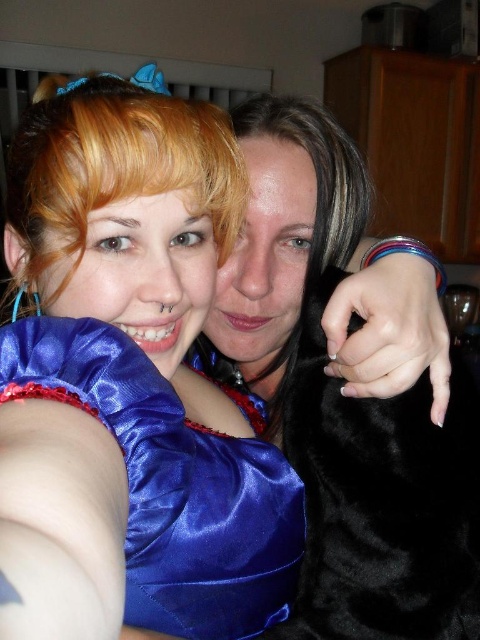
Between satin blue dress at upper left and blonde silky hair at upper left, which one appears on the right side from the viewer's perspective?

Positioned to the right is satin blue dress at upper left.

Does satin blue dress at upper left have a lesser width compared to blonde silky hair at upper left?

In fact, satin blue dress at upper left might be wider than blonde silky hair at upper left.

In order to click on satin blue dress at upper left in this screenshot , I will do `click(130, 381)`.

Where is `satin blue dress at upper left`? The height and width of the screenshot is (640, 480). satin blue dress at upper left is located at coordinates (130, 381).

Measure the distance between satin blue dress at upper left and camera.

satin blue dress at upper left and camera are 18.43 centimeters apart from each other.

Locate an element on the screen. The image size is (480, 640). satin blue dress at upper left is located at coordinates (130, 381).

This screenshot has height=640, width=480. I want to click on satin blue dress at upper left, so pyautogui.click(x=130, y=381).

Is black fur coat at right positioned before blonde silky hair at upper left?

No, black fur coat at right is behind blonde silky hair at upper left.

Can you confirm if black fur coat at right is shorter than blonde silky hair at upper left?

In fact, black fur coat at right may be taller than blonde silky hair at upper left.

Which is behind, point (286, 397) or point (48, 264)?

The point (286, 397) is behind.

Find the location of a particular element. This screenshot has width=480, height=640. black fur coat at right is located at coordinates (344, 401).